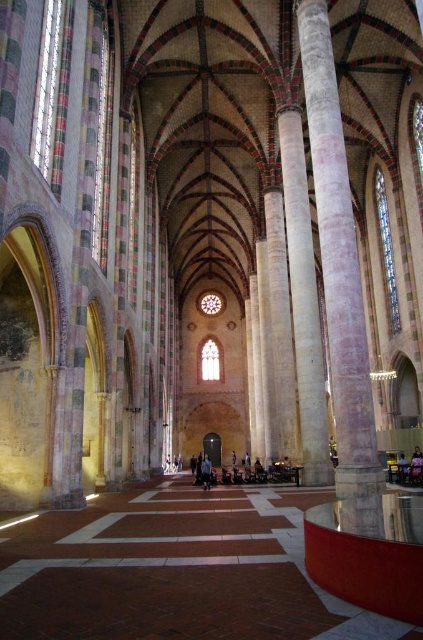
Who is positioned more to the right, clear glass window at left or stained glass window at right?

stained glass window at right is more to the right.

Is point (60, 4) more distant than point (382, 278)?

No, it is in front of (382, 278).

Which is behind, point (44, 163) or point (375, 180)?

The point (375, 180) is more distant.

Find the location of a particular element. The width and height of the screenshot is (423, 640). clear glass window at left is located at coordinates (47, 88).

Can you confirm if white marble pillar at right is positioned below clear glass window at center?

Incorrect, white marble pillar at right is not positioned below clear glass window at center.

Consider the image. Does white marble pillar at right have a lesser width compared to clear glass window at center?

No, white marble pillar at right is not thinner than clear glass window at center.

Does point (318, 216) lie in front of point (205, 346)?

Yes, it is.

Locate an element on the screen. The image size is (423, 640). white marble pillar at right is located at coordinates (340, 284).

Between point (315, 337) and point (375, 195), which one is positioned behind?

Point (375, 195)

Does white marble pillar at center have a greater height compared to stained glass window at right?

Indeed, white marble pillar at center has a greater height compared to stained glass window at right.

Between point (290, 212) and point (395, 305), which one is positioned in front?

Point (290, 212) is more forward.

Where is `white marble pillar at center`? white marble pillar at center is located at coordinates (304, 304).